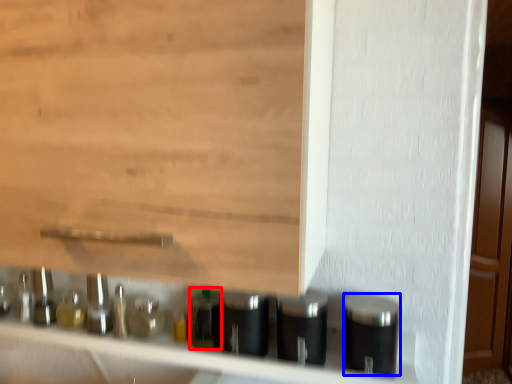
Question: Which object is closer to the camera taking this photo, bottle (highlighted by a red box) or silver (highlighted by a blue box)?

Choices:
 (A) bottle
 (B) silver

Answer: (B)